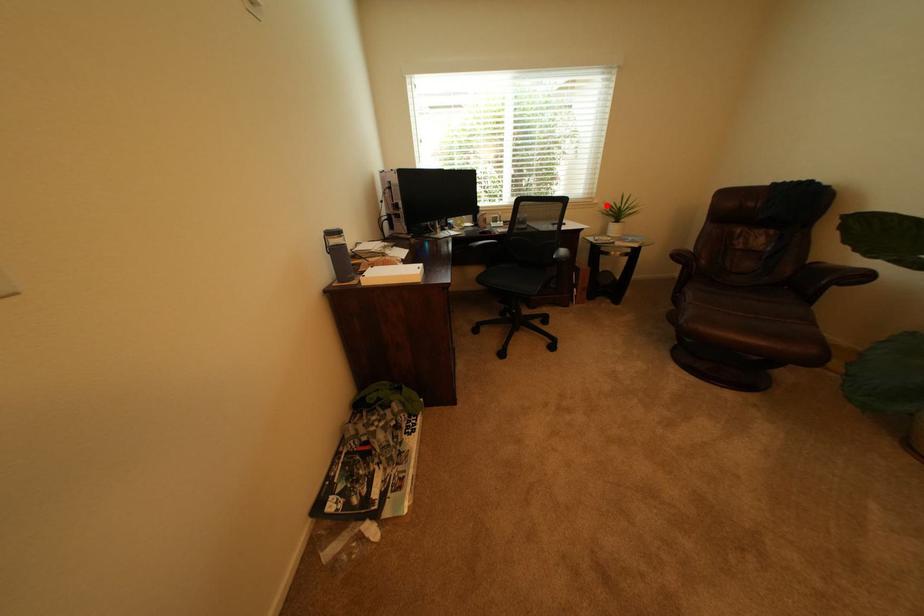
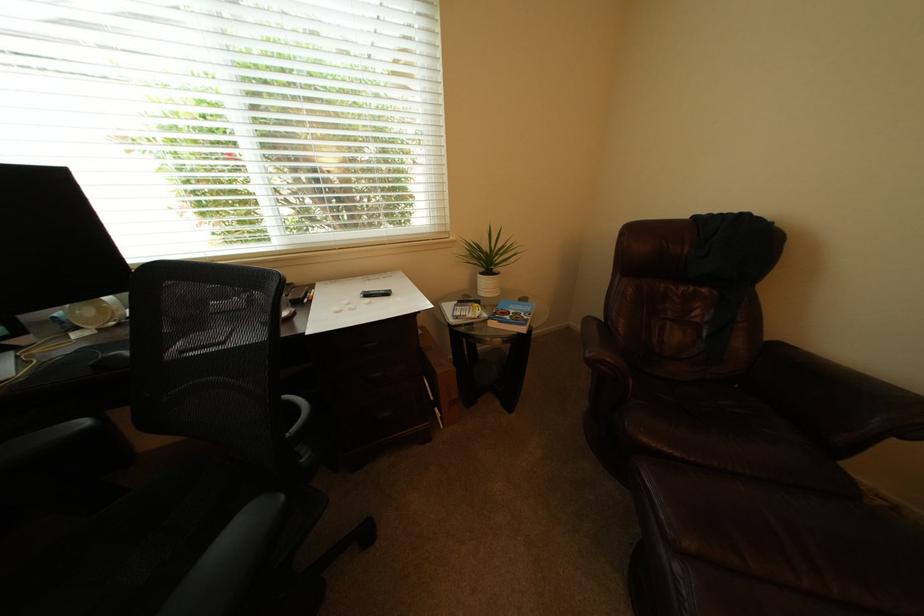
Find the pixel in the second image that matches the highlighted location in the first image.

(466, 243)